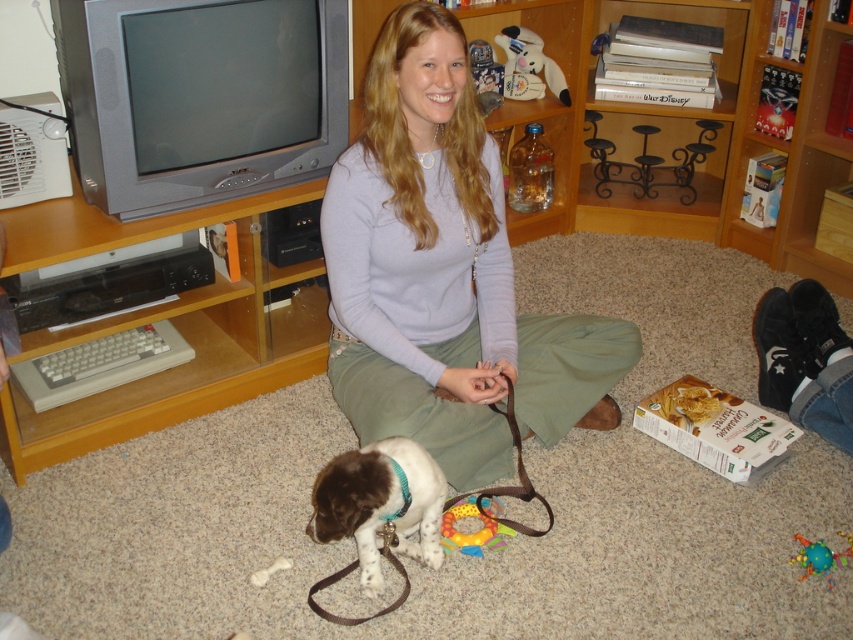
Question: Can you confirm if wooden entertainment center at lower left is positioned above white plush toy at upper center?

Choices:
 (A) yes
 (B) no

Answer: (B)

Question: Does light purple sweater at center appear over white fur at lower center?

Choices:
 (A) no
 (B) yes

Answer: (B)

Question: Which object is closer to the camera taking this photo?

Choices:
 (A) white plush toy at upper center
 (B) light purple sweater at center

Answer: (B)

Question: Is rubber/plastic dog toy at lower center closer to the viewer compared to multicolored rubber ball at lower right?

Choices:
 (A) no
 (B) yes

Answer: (A)

Question: Which object is farther from the camera taking this photo?

Choices:
 (A) light purple sweater at center
 (B) rubber/plastic dog toy at lower center
 (C) wooden entertainment center at lower left
 (D) white plush toy at upper center

Answer: (D)

Question: Which point is farther from the camera taking this photo?

Choices:
 (A) (367, 538)
 (B) (508, 531)
 (C) (453, 410)

Answer: (C)